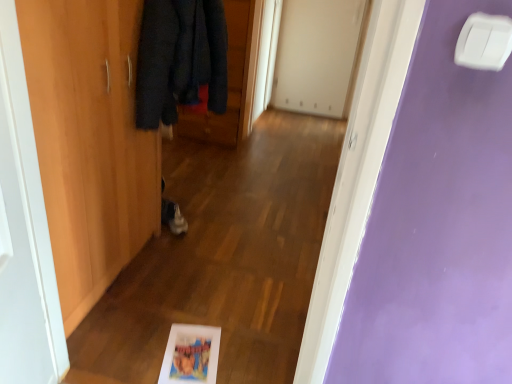
The image size is (512, 384). Identify the location of blank space situated above matte plastic picture frame at lower center (from a real-world perspective). (192, 350).